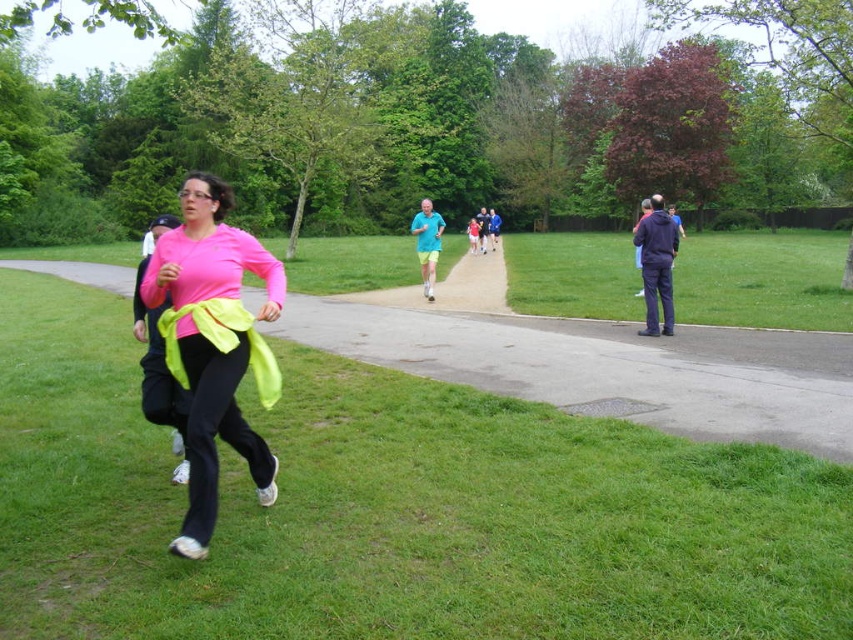
You are standing at the point labeled point (235, 326) and want to walk towards the point labeled point (643, 275). Which direction should you face to move directly towards it?

You should face towards the upper left direction because point (643, 275) is located above and to the left of point (235, 326).

You are a photographer positioned at the edge of the grassy area. You notice two blue shirts at the center of the image, one labeled as matte blue shirt at center and the other as blue fabric shirt at center. Which one is positioned higher in the image?

The matte blue shirt at center is located above the blue fabric shirt at center, so the matte blue shirt at center is positioned higher in the image.